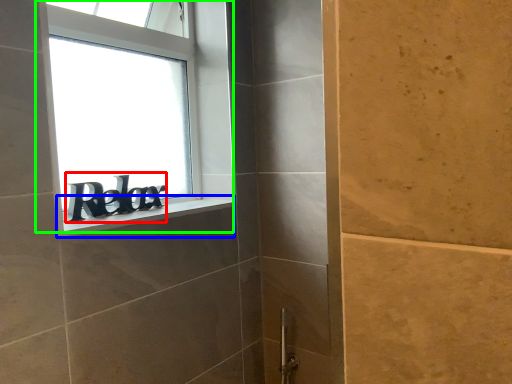
Question: Which object is the farthest from writing (highlighted by a red box)? Choose among these: window sill (highlighted by a blue box) or window (highlighted by a green box).

Choices:
 (A) window sill
 (B) window

Answer: (B)